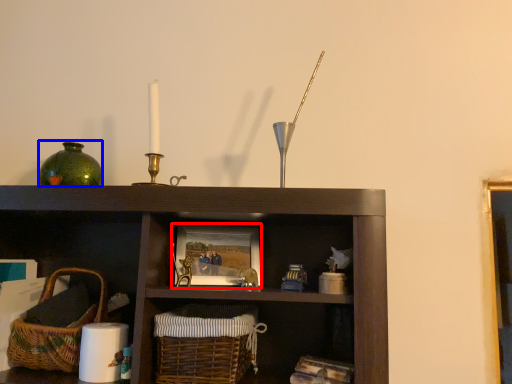
Question: Which object is further to the camera taking this photo, picture frame (highlighted by a red box) or glass vase (highlighted by a blue box)?

Choices:
 (A) picture frame
 (B) glass vase

Answer: (B)